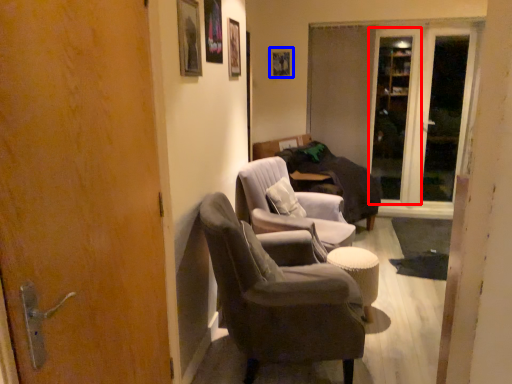
Question: Among these objects, which one is farthest to the camera, screen door (highlighted by a red box) or picture frame (highlighted by a blue box)?

Choices:
 (A) screen door
 (B) picture frame

Answer: (B)